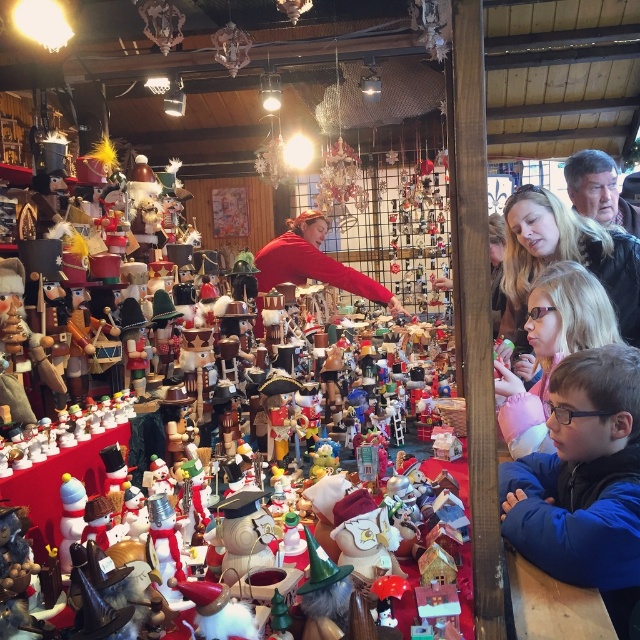
You are a customer in the market and want to buy a gift for a friend. You see the blue fleece jacket at lower right and the blonde hair at upper right. Which item is smaller in size?

The blue fleece jacket at lower right is smaller than the blonde hair at upper right according to the description.